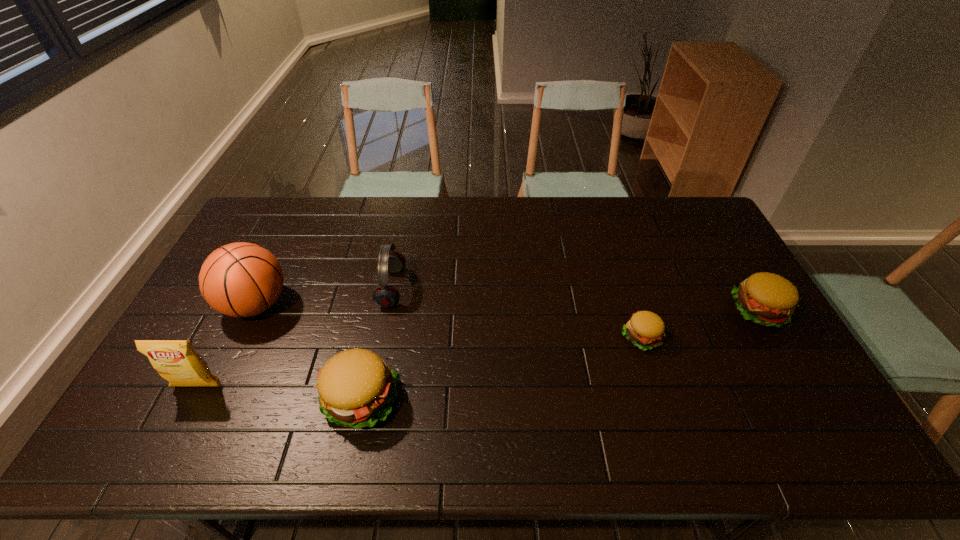
This screenshot has width=960, height=540. Identify the location of the nearest hamburger. (356, 388).

Identify the location of the fifth object from left to right. (645, 329).

Where is `the shortest hamburger`? the shortest hamburger is located at coordinates (645, 329).

Image resolution: width=960 pixels, height=540 pixels. Identify the location of the second tallest hamburger. (767, 299).

Locate an element on the screen. the rightmost hamburger is located at coordinates (767, 299).

At what (x,y) coordinates should I click in order to perform the action: click on basketball. Please return your answer as a coordinate pair (x, y). This screenshot has height=540, width=960. Looking at the image, I should click on (241, 279).

At what (x,y) coordinates should I click in order to perform the action: click on earphone. Please return your answer as a coordinate pair (x, y). This screenshot has height=540, width=960. Looking at the image, I should click on (x=385, y=296).

This screenshot has width=960, height=540. What are the coordinates of `crisp (potato chip)` in the screenshot? It's located at (177, 361).

Where is `vacant space positioned on the left of the nearest hamburger`? The image size is (960, 540). vacant space positioned on the left of the nearest hamburger is located at coordinates (254, 400).

This screenshot has height=540, width=960. In order to click on vacant region located on the back of the second hamburger from right to left in this screenshot , I will do pos(618,267).